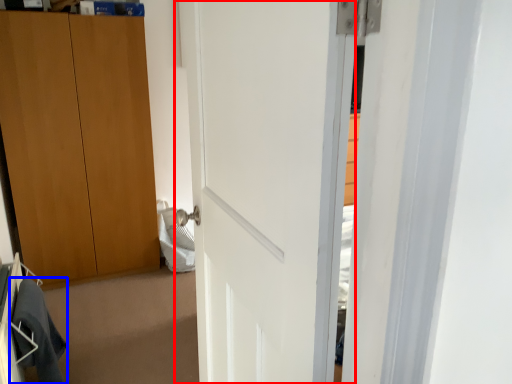
Question: Which object is closer to the camera taking this photo, door (highlighted by a red box) or robe (highlighted by a blue box)?

Choices:
 (A) door
 (B) robe

Answer: (A)